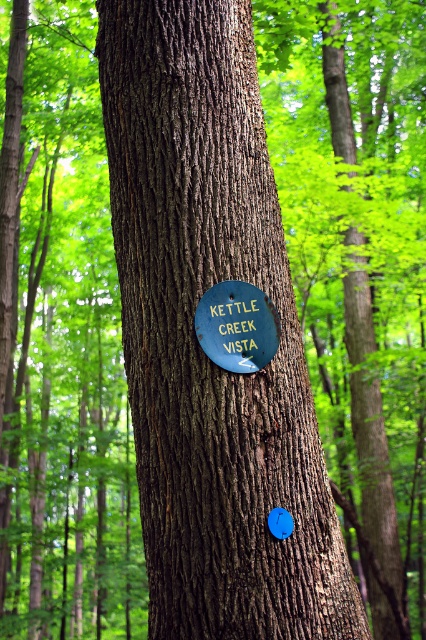
Question: Is smooth brown bark at center closer to the viewer compared to green matte sign at center?

Choices:
 (A) no
 (B) yes

Answer: (B)

Question: Among these objects, which one is farthest from the camera?

Choices:
 (A) smooth brown bark at center
 (B) green matte sign at center

Answer: (B)

Question: Among these objects, which one is nearest to the camera?

Choices:
 (A) smooth brown bark at center
 (B) green matte sign at center

Answer: (A)

Question: Does smooth brown bark at center appear under green matte sign at center?

Choices:
 (A) no
 (B) yes

Answer: (A)

Question: Can you confirm if smooth brown bark at center is wider than green matte sign at center?

Choices:
 (A) yes
 (B) no

Answer: (A)